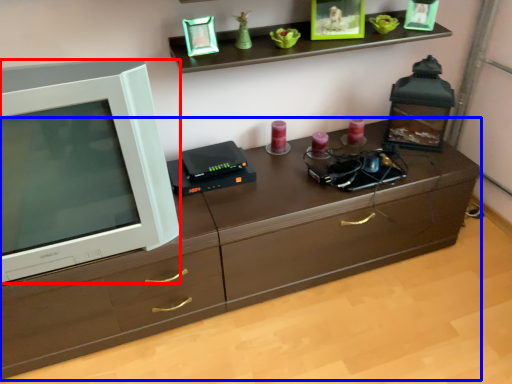
Question: Among these objects, which one is nearest to the camera, television (highlighted by a red box) or chest of drawers (highlighted by a blue box)?

Choices:
 (A) television
 (B) chest of drawers

Answer: (A)